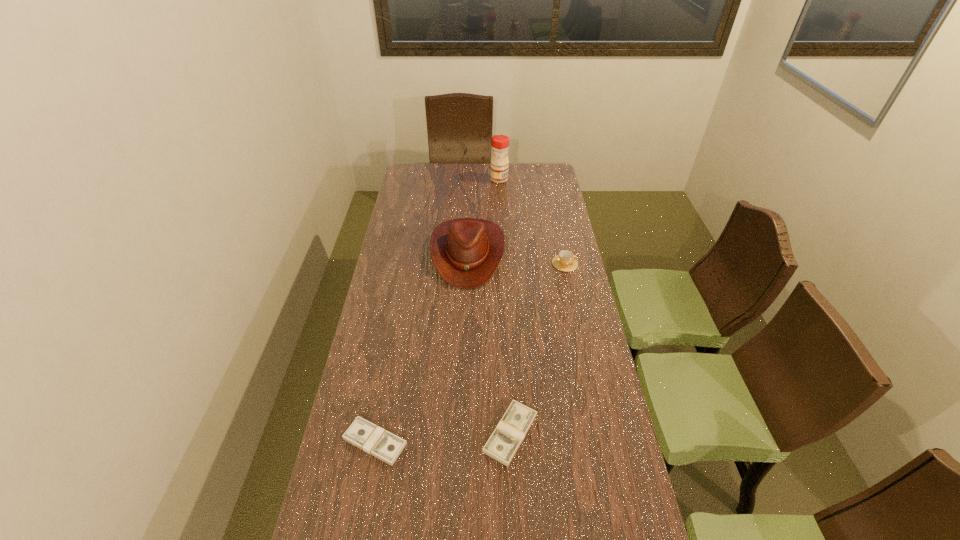
Where is `free region located 0.250m on the back of the left dollar`? This screenshot has width=960, height=540. free region located 0.250m on the back of the left dollar is located at coordinates (392, 351).

The image size is (960, 540). Identify the location of object present at the far edge. 500,143.

This screenshot has width=960, height=540. In order to click on object at the left edge in this screenshot , I will do `click(363, 434)`.

Locate an element on the screen. This screenshot has width=960, height=540. object located in the right edge section of the desktop is located at coordinates (565, 261).

Where is `free space at the far edge`? The image size is (960, 540). free space at the far edge is located at coordinates (483, 170).

Image resolution: width=960 pixels, height=540 pixels. I want to click on free space at the left edge of the desktop, so click(370, 396).

In the image, there is a desktop. Identify the location of vacant space at the right edge. The image size is (960, 540). (589, 360).

Find the location of a particular element. vacant space at the far left corner of the desktop is located at coordinates (419, 164).

The height and width of the screenshot is (540, 960). I want to click on free space between the cowboy hat and the cup, so click(516, 258).

Where is `free spot between the rightmost object and the left dollar`? free spot between the rightmost object and the left dollar is located at coordinates (470, 353).